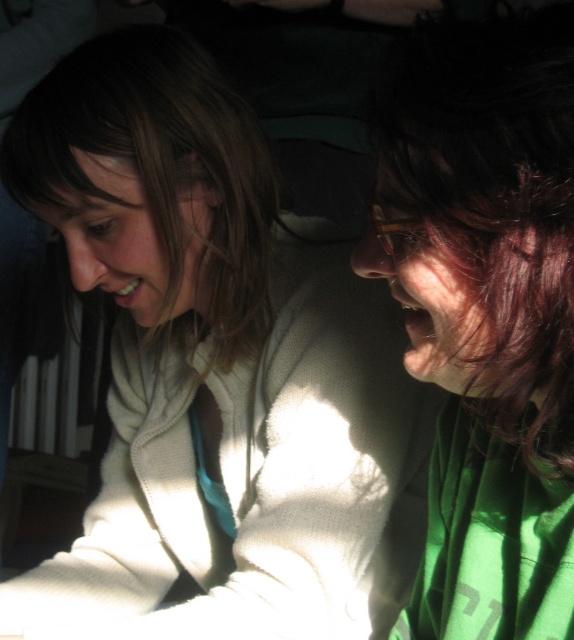
You are a photographer trying to capture a candid shot of the two people in the scene. You want to ensure that both the white fuzzy sweater at center and the shiny brown hair at right are clearly visible in the frame. Given their sizes, which object should you focus on first to ensure proper exposure?

The white fuzzy sweater at center should be focused on first because it is larger than the shiny brown hair at right, making it more prominent in the frame and requiring proper exposure to highlight its details.

You are a photographer trying to capture a candid shot of the two people in the scene. You want to ensure that both the white fuzzy sweater at center and the shiny brown hair at right are clearly visible in the frame. Based on their relative sizes in the image, which object should you focus on first to ensure proper exposure?

The white fuzzy sweater at center is taller than the shiny brown hair at right, so focusing on the white fuzzy sweater at center first will help ensure proper exposure since it occupies more space in the frame.

Looking at this image, you are a photographer trying to capture a candid shot of the two people in the scene. You notice the white fuzzy sweater at center and the shiny brown hair at right. Which object should you focus on if you want to capture something wider in your frame?

The white fuzzy sweater at center should be focused on since its width is larger than the shiny brown hair at right, making it the wider object in the scene.